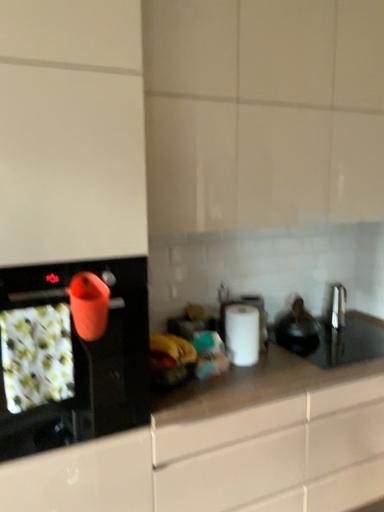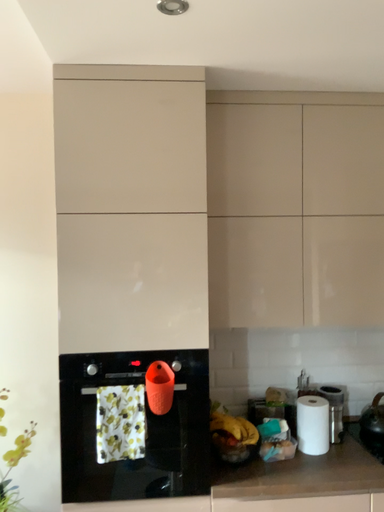
Question: How did the camera likely rotate when shooting the video?

Choices:
 (A) rotated downward
 (B) rotated upward

Answer: (B)